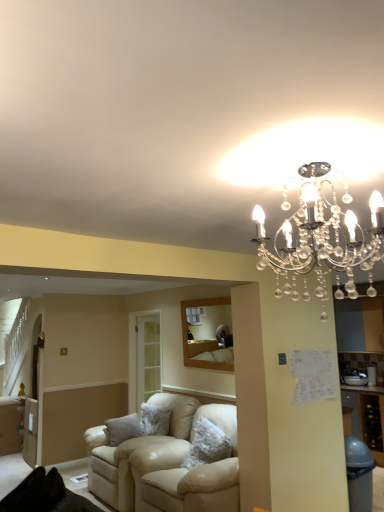
Question: From a real-world perspective, relative to clear crystal chandelier at upper center, is beige leather couch at center vertically above or below?

Choices:
 (A) above
 (B) below

Answer: (B)

Question: Relative to clear crystal chandelier at upper center, is beige leather couch at center in front or behind?

Choices:
 (A) behind
 (B) front

Answer: (A)

Question: Is point (163, 494) closer or farther from the camera than point (301, 224)?

Choices:
 (A) farther
 (B) closer

Answer: (A)

Question: From the image's perspective, relative to beige leather couch at center, is clear crystal chandelier at upper center above or below?

Choices:
 (A) below
 (B) above

Answer: (B)

Question: Considering the positions of clear crystal chandelier at upper center and beige leather couch at center in the image, is clear crystal chandelier at upper center bigger or smaller than beige leather couch at center?

Choices:
 (A) small
 (B) big

Answer: (A)

Question: Considering the relative positions of clear crystal chandelier at upper center and beige leather couch at center in the image provided, is clear crystal chandelier at upper center to the left or to the right of beige leather couch at center?

Choices:
 (A) right
 (B) left

Answer: (A)

Question: Considering the positions of point (352, 236) and point (92, 431), is point (352, 236) closer or farther from the camera than point (92, 431)?

Choices:
 (A) farther
 (B) closer

Answer: (B)